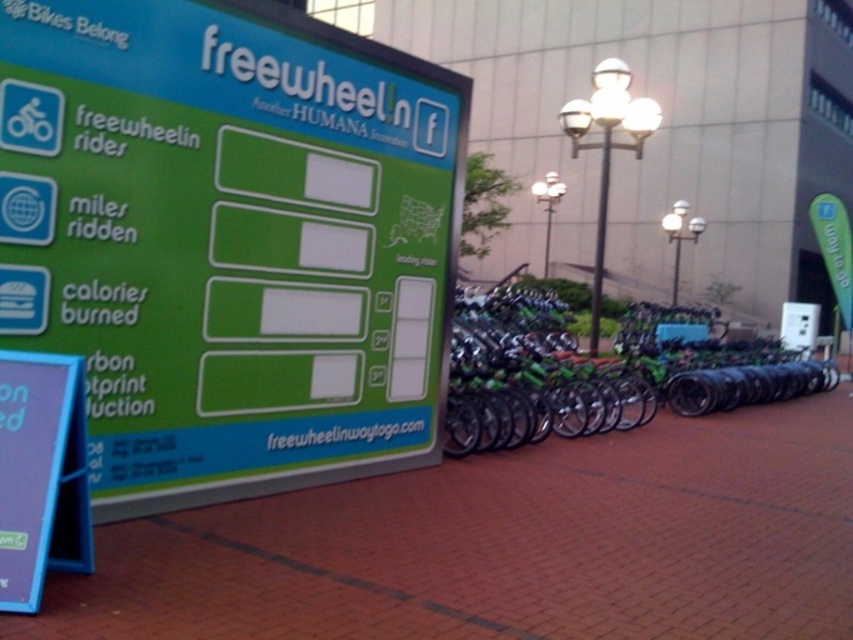
Which is behind, point (274, 160) or point (593, 276)?

Positioned behind is point (593, 276).

Based on the photo, does green matte sign at upper left appear on the right side of metallic pole at center?

Incorrect, green matte sign at upper left is not on the right side of metallic pole at center.

Does point (172, 237) come farther from viewer compared to point (596, 284)?

No, it is not.

Find the location of a particular element. This screenshot has height=640, width=853. green matte sign at upper left is located at coordinates (229, 241).

Does green matte sign at upper left appear over green matte bicycle at center?

Yes, green matte sign at upper left is above green matte bicycle at center.

Does green matte sign at upper left appear under green matte bicycle at center?

Actually, green matte sign at upper left is above green matte bicycle at center.

Between point (427, 273) and point (685, 374), which one is positioned in front?

Point (427, 273) is in front.

Image resolution: width=853 pixels, height=640 pixels. Identify the location of green matte sign at upper left. (229, 241).

Does brick pavement at center have a greater width compared to metallic pole at center?

Indeed, brick pavement at center has a greater width compared to metallic pole at center.

Who is more distant from viewer, (790,577) or (590,298)?

The point (590,298) is more distant.

Which is behind, point (103, 625) or point (595, 300)?

The point (595, 300) is more distant.

Find the location of a particular element. The width and height of the screenshot is (853, 640). brick pavement at center is located at coordinates (508, 545).